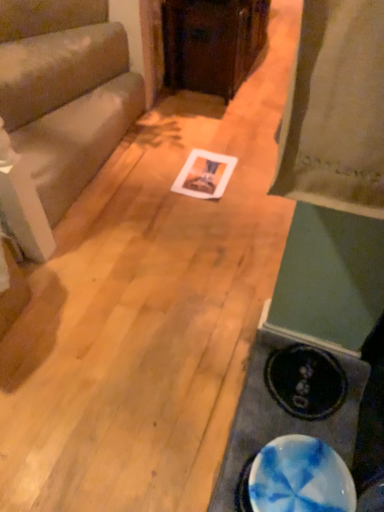
Locate an element on the screen. The width and height of the screenshot is (384, 512). free space above matte gray couch at left, which ranks as the second furniture in right-to-left order (from a real-world perspective) is located at coordinates (63, 117).